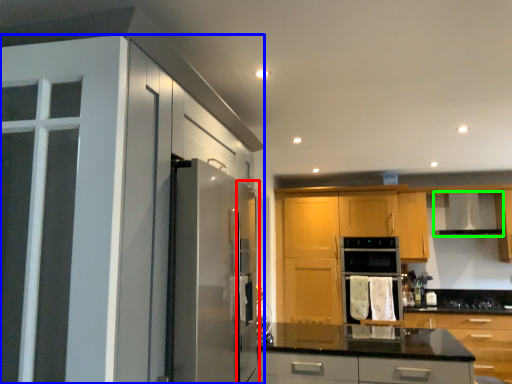
Question: Which object is the closest to the screen door (highlighted by a red box)? Choose among these: cabinetry (highlighted by a blue box) or exhaust hood (highlighted by a green box).

Choices:
 (A) cabinetry
 (B) exhaust hood

Answer: (A)